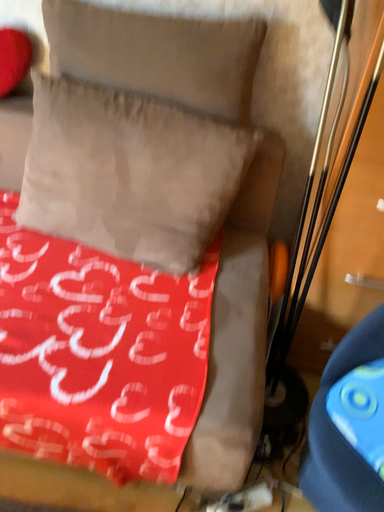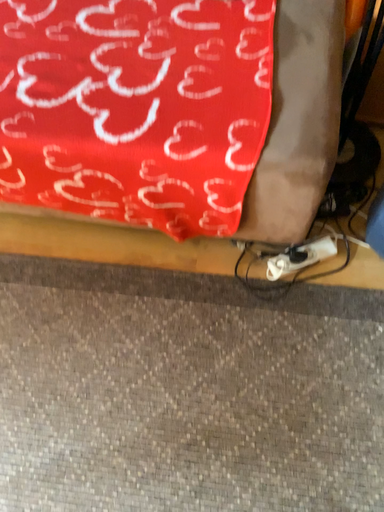
Question: Which way did the camera rotate in the video?

Choices:
 (A) rotated upward
 (B) rotated downward

Answer: (B)